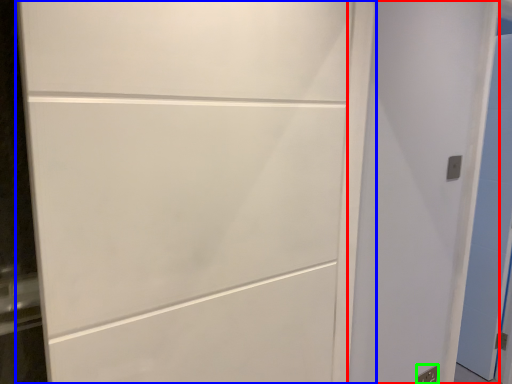
Question: Which is farther away from door (highlighted by a red box)? door (highlighted by a blue box) or electric outlet (highlighted by a green box)?

Choices:
 (A) door
 (B) electric outlet

Answer: (B)